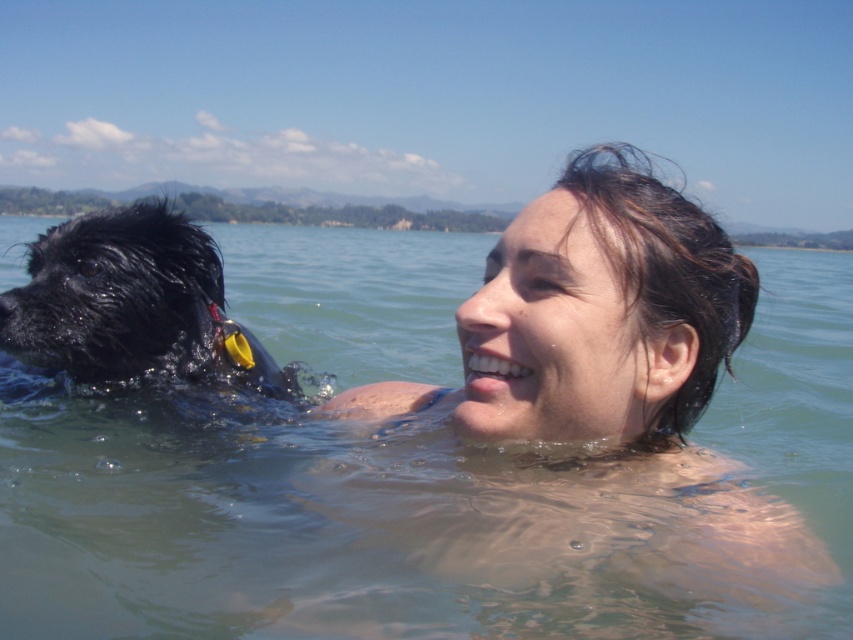
Question: Which point appears closest to the camera in this image?

Choices:
 (A) (113, 403)
 (B) (68, 314)

Answer: (B)

Question: Is clear water at upper center to the left of wet black fur at left from the viewer's perspective?

Choices:
 (A) no
 (B) yes

Answer: (A)

Question: Can you confirm if clear water at upper center is positioned to the right of wet black fur at left?

Choices:
 (A) yes
 (B) no

Answer: (A)

Question: Which point is closer to the camera?

Choices:
 (A) clear water at upper center
 (B) wet black fur at left

Answer: (A)

Question: Is clear water at upper center to the left of wet black fur at left from the viewer's perspective?

Choices:
 (A) no
 (B) yes

Answer: (A)